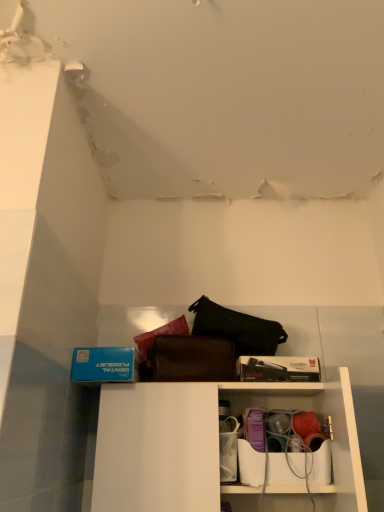
You are a GUI agent. You are given a task and a screenshot of the screen. Output one action in this format:
    pyautogui.click(x=<x>, y=<y>)
    Task: Click on the white plastic shelf at lower center
    The width and height of the screenshot is (384, 512).
    Given the screenshot: What is the action you would take?
    pyautogui.click(x=206, y=444)

Describe the element at coordinates (206, 444) in the screenshot. I see `white plastic shelf at lower center` at that location.

The height and width of the screenshot is (512, 384). I want to click on matte plastic container at lower center, so click(x=281, y=472).

What do you see at coordinates (281, 472) in the screenshot? This screenshot has width=384, height=512. I see `matte plastic container at lower center` at bounding box center [281, 472].

Find the location of a particular element. The height and width of the screenshot is (512, 384). white plastic shelf at lower center is located at coordinates (206, 444).

Between white plastic shelf at lower center and matte plastic container at lower center, which one appears on the left side from the viewer's perspective?

From the viewer's perspective, white plastic shelf at lower center appears more on the left side.

Consider the image. Is the position of white plastic shelf at lower center less distant than that of matte plastic container at lower center?

Yes, it is.

Considering the positions of point (146, 453) and point (281, 471), is point (146, 453) closer or farther from the camera than point (281, 471)?

Clearly, point (146, 453) is closer to the camera than point (281, 471).

From the image's perspective, which one is positioned higher, white plastic shelf at lower center or matte plastic container at lower center?

white plastic shelf at lower center.

Based on the photo, from a real-world perspective, is white plastic shelf at lower center physically above matte plastic container at lower center?

Indeed, from a real-world perspective, white plastic shelf at lower center stands above matte plastic container at lower center.

Is white plastic shelf at lower center wider than matte plastic container at lower center?

Yes.

Is white plastic shelf at lower center shorter than matte plastic container at lower center?

No, white plastic shelf at lower center is not shorter than matte plastic container at lower center.

Considering the sizes of objects white plastic shelf at lower center and matte plastic container at lower center in the image provided, who is smaller, white plastic shelf at lower center or matte plastic container at lower center?

matte plastic container at lower center is smaller.

Is white plastic shelf at lower center inside the boundaries of matte plastic container at lower center, or outside?

white plastic shelf at lower center exists outside the volume of matte plastic container at lower center.

Is white plastic shelf at lower center beside matte plastic container at lower center?

There is a gap between white plastic shelf at lower center and matte plastic container at lower center.

Is white plastic shelf at lower center aimed at matte plastic container at lower center?

No, white plastic shelf at lower center is not facing towards matte plastic container at lower center.

How many degrees apart are the facing directions of white plastic shelf at lower center and matte plastic container at lower center?

There is a 0.0901-degree angle between the facing directions of white plastic shelf at lower center and matte plastic container at lower center.

Where is `cabinet on the right of white plastic shelf at lower center`? The width and height of the screenshot is (384, 512). cabinet on the right of white plastic shelf at lower center is located at coordinates (281, 472).

Between matte plastic container at lower center and white plastic shelf at lower center, which one appears on the left side from the viewer's perspective?

white plastic shelf at lower center is more to the left.

Is the position of matte plastic container at lower center less distant than that of white plastic shelf at lower center?

No, matte plastic container at lower center is further to the viewer.

Which is in front, point (283, 490) or point (196, 448)?

Point (283, 490)

From the image's perspective, which is below, matte plastic container at lower center or white plastic shelf at lower center?

matte plastic container at lower center appears lower in the image.

From a real-world perspective, is matte plastic container at lower center located higher than white plastic shelf at lower center?

Actually, matte plastic container at lower center is physically below white plastic shelf at lower center in the real world.

Which object is wider, matte plastic container at lower center or white plastic shelf at lower center?

white plastic shelf at lower center.

Between matte plastic container at lower center and white plastic shelf at lower center, which one has more height?

white plastic shelf at lower center.

Is matte plastic container at lower center bigger or smaller than white plastic shelf at lower center?

matte plastic container at lower center is smaller than white plastic shelf at lower center.

Is matte plastic container at lower center positioned beyond the bounds of white plastic shelf at lower center?

No, matte plastic container at lower center is inside white plastic shelf at lower center's boundary.

Looking at this image, are matte plastic container at lower center and white plastic shelf at lower center making contact?

matte plastic container at lower center is not next to white plastic shelf at lower center, and they're not touching.

Looking at this image, does matte plastic container at lower center turn towards white plastic shelf at lower center?

Yes.

Find the location of a particular element. The width and height of the screenshot is (384, 512). shelf located above the matte plastic container at lower center (from the image's perspective) is located at coordinates coord(206,444).

Locate an element on the screen. The height and width of the screenshot is (512, 384). cabinet behind the white plastic shelf at lower center is located at coordinates (281, 472).

You are a GUI agent. You are given a task and a screenshot of the screen. Output one action in this format:
    pyautogui.click(x=<x>, y=<y>)
    Task: Click on the cabinet below the white plastic shelf at lower center (from the image's perspective)
    
    Given the screenshot: What is the action you would take?
    pyautogui.click(x=281, y=472)